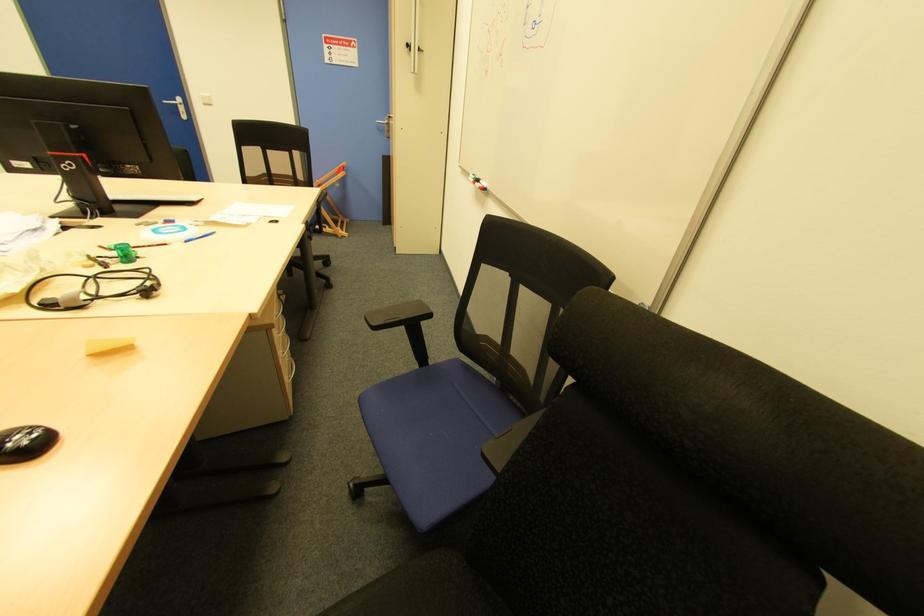
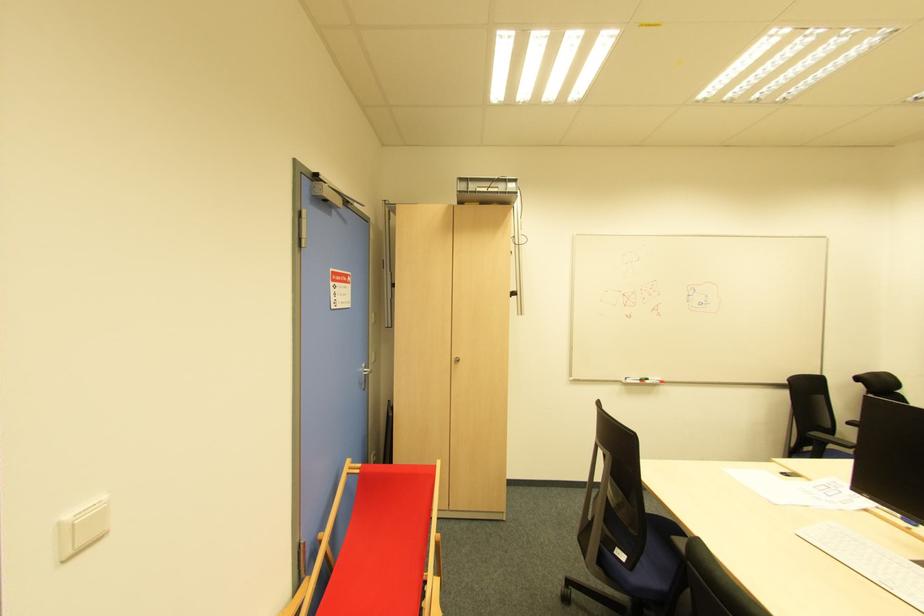
In the second image, find the point that corresponds to (x=201, y=95) in the first image.

(69, 517)